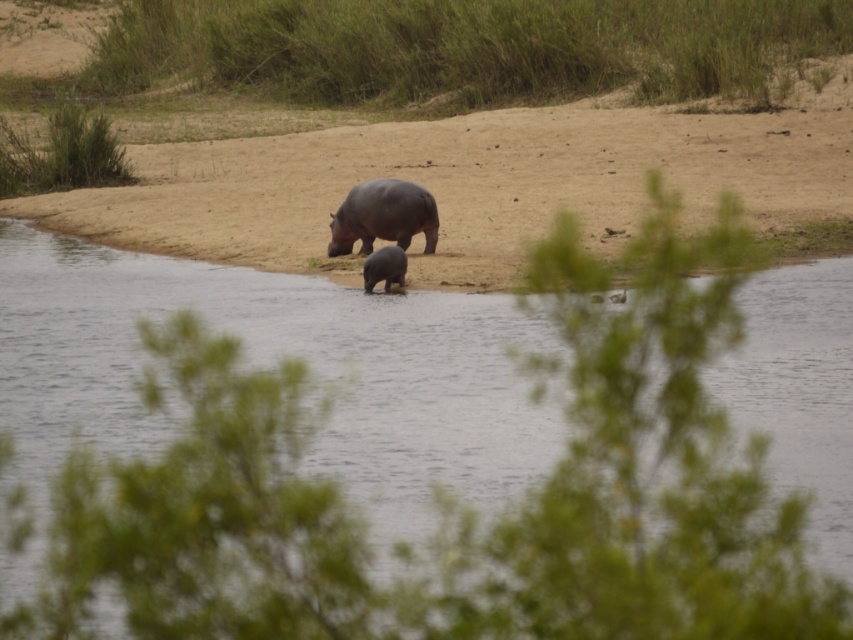
Question: Is clear water at river center further to the viewer compared to gray matte elephant at center?

Choices:
 (A) yes
 (B) no

Answer: (B)

Question: Is clear water at river center smaller than gray matte elephant at center?

Choices:
 (A) yes
 (B) no

Answer: (B)

Question: Does clear water at river center have a lesser width compared to dark gray matte hippo at center?

Choices:
 (A) yes
 (B) no

Answer: (B)

Question: Based on their relative distances, which object is farther from the dark gray matte hippo at center?

Choices:
 (A) gray matte elephant at center
 (B) clear water at river center

Answer: (B)

Question: Estimate the real-world distances between objects in this image. Which object is farther from the clear water at river center?

Choices:
 (A) gray matte elephant at center
 (B) dark gray matte hippo at center

Answer: (B)

Question: Which point is closer to the camera?

Choices:
 (A) (373, 284)
 (B) (386, 182)
 (C) (299, 321)

Answer: (C)